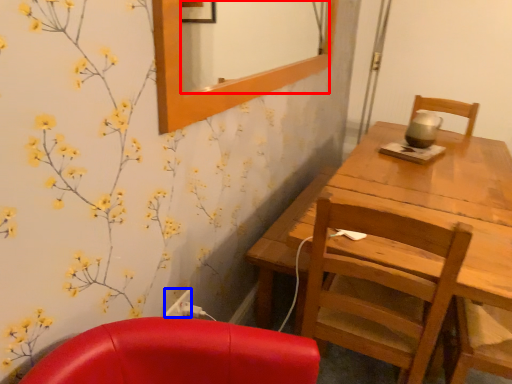
Question: Which object is closer to the camera taking this photo, mirror (highlighted by a red box) or power outlet (highlighted by a blue box)?

Choices:
 (A) mirror
 (B) power outlet

Answer: (A)